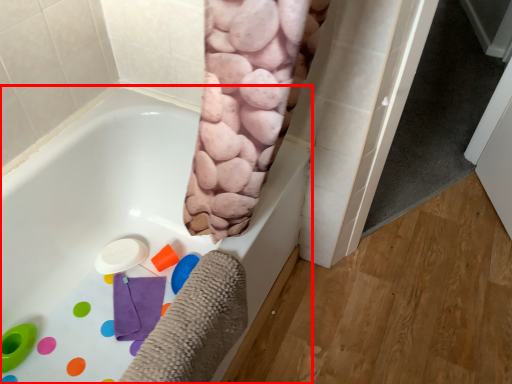
Question: Where is bathtub (annotated by the red box) located in relation to screen door in the image?

Choices:
 (A) right
 (B) left

Answer: (B)